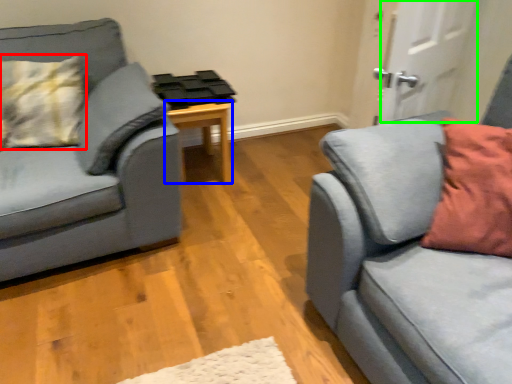
Question: Considering the real-world distances, which object is closest to pillow (highlighted by a red box)? table (highlighted by a blue box) or door (highlighted by a green box).

Choices:
 (A) table
 (B) door

Answer: (A)